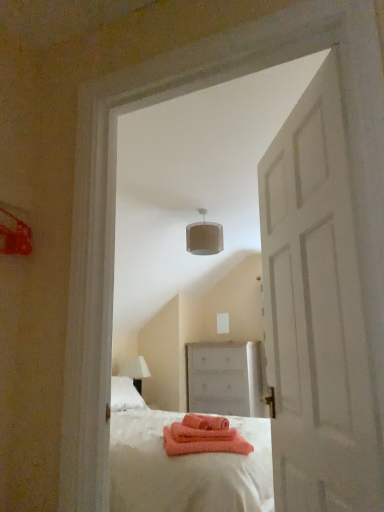
At what (x,y) coordinates should I click in order to perform the action: click on free space above white textured lampshade at upper center (from a real-world perspective). Please return your answer as a coordinate pair (x, y). The height and width of the screenshot is (512, 384). Looking at the image, I should click on tap(215, 208).